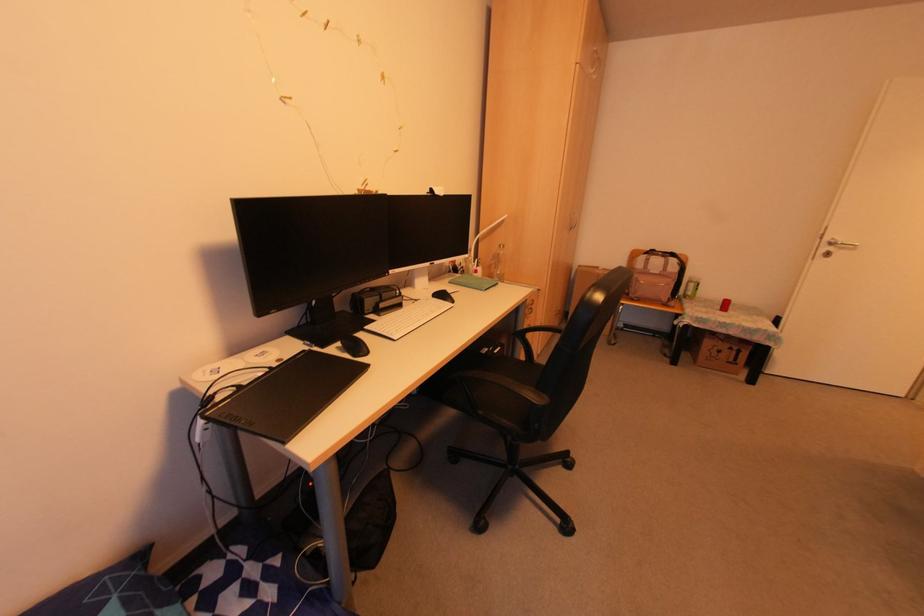
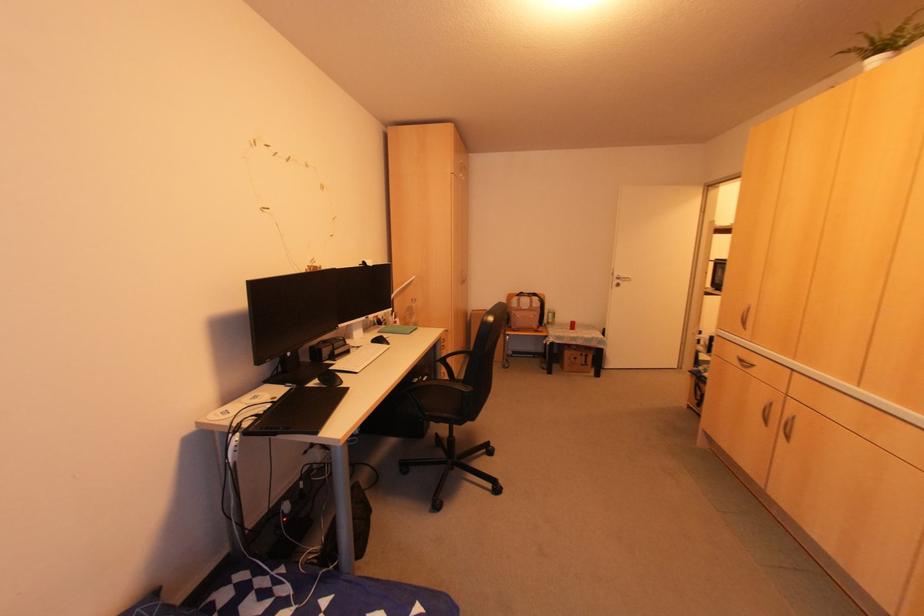
In a continuous first-person perspective shot, in which direction is the camera moving?

The movement direction of the cameraman is left, backward.